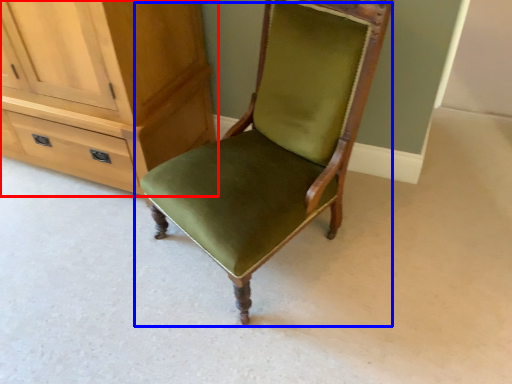
Question: Among these objects, which one is nearest to the camera, cabinetry (highlighted by a red box) or chair (highlighted by a blue box)?

Choices:
 (A) cabinetry
 (B) chair

Answer: (B)